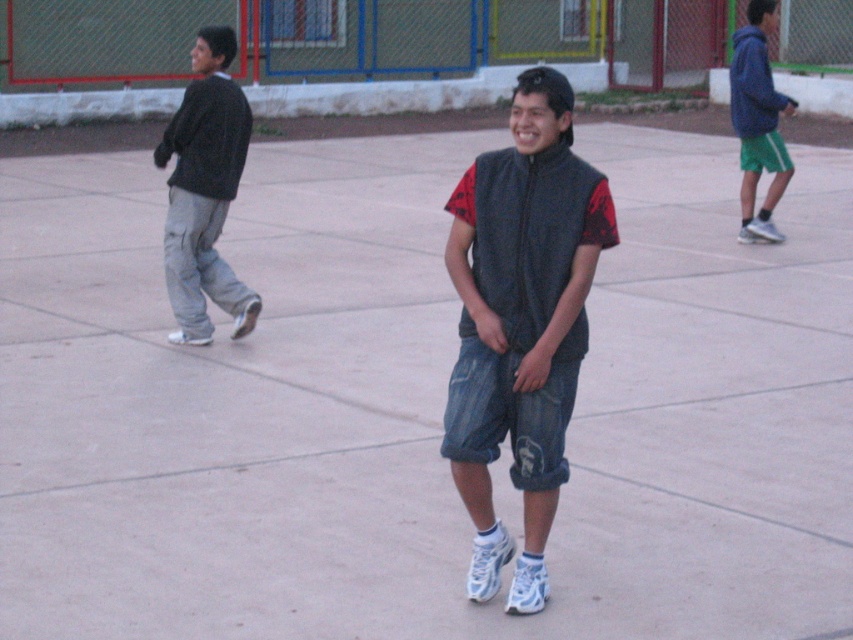
Does dark gray sweater at left have a smaller size compared to green shorts at right?

Indeed, dark gray sweater at left has a smaller size compared to green shorts at right.

Looking at this image, can you confirm if dark gray sweater at left is bigger than green shorts at right?

Answer: No.

The width and height of the screenshot is (853, 640). What do you see at coordinates (204, 192) in the screenshot?
I see `dark gray sweater at left` at bounding box center [204, 192].

You are a GUI agent. You are given a task and a screenshot of the screen. Output one action in this format:
    pyautogui.click(x=<x>, y=<y>)
    Task: Click on the dark gray sweater at left
    
    Given the screenshot: What is the action you would take?
    pyautogui.click(x=204, y=192)

Between denim shorts at center and green shorts at right, which one is positioned higher?

green shorts at right is higher up.

Can you confirm if denim shorts at center is positioned to the right of green shorts at right?

No, denim shorts at center is not to the right of green shorts at right.

What do you see at coordinates (520, 323) in the screenshot?
I see `denim shorts at center` at bounding box center [520, 323].

Image resolution: width=853 pixels, height=640 pixels. Find the location of `denim shorts at center`. denim shorts at center is located at coordinates (520, 323).

Which is more to the right, denim shorts at center or dark gray sweater at left?

denim shorts at center

Is point (515, 436) farther from camera compared to point (241, 317)?

No, (515, 436) is in front of (241, 317).

Where is `denim shorts at center`? denim shorts at center is located at coordinates (520, 323).